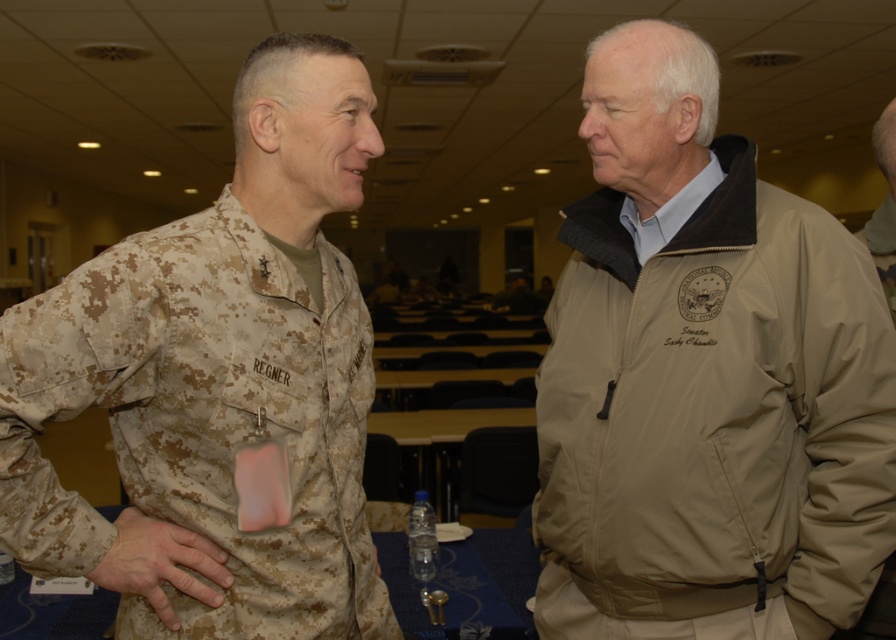
Question: Which point appears farthest from the camera in this image?

Choices:
 (A) (679, 83)
 (B) (42, 556)

Answer: (A)

Question: Which of the following is the farthest from the observer?

Choices:
 (A) (721, 188)
 (B) (221, 596)

Answer: (A)

Question: Among these points, which one is nearest to the camera?

Choices:
 (A) (x=675, y=547)
 (B) (x=179, y=556)

Answer: (B)

Question: In this image, where is camouflage fabric uniform at left located relative to camouflage fabric hand at center?

Choices:
 (A) above
 (B) below

Answer: (A)

Question: Is tan fabric jacket at center thinner than camouflage fabric hand at center?

Choices:
 (A) yes
 (B) no

Answer: (B)

Question: Is tan fabric jacket at center above camouflage fabric uniform at left?

Choices:
 (A) no
 (B) yes

Answer: (B)